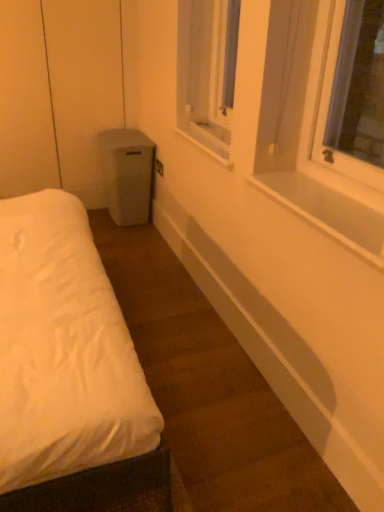
This screenshot has width=384, height=512. Identify the location of white plastic window sill at center, which ranks as the second window sill in front-to-back order. (204, 145).

At what (x,y) coordinates should I click in order to perform the action: click on white smooth window sill at upper right, positioned as the 1th window sill in bottom-to-top order. Please return your answer as a coordinate pair (x, y). The image size is (384, 512). Looking at the image, I should click on (328, 212).

Looking at this image, could you measure the distance between white smooth window sill at upper right, which is counted as the first window sill, starting from the front, and white plastic window sill at center, arranged as the first window sill when viewed from the top?

The distance of white smooth window sill at upper right, which is counted as the first window sill, starting from the front, from white plastic window sill at center, arranged as the first window sill when viewed from the top, is 24.22 inches.

Is the depth of white smooth window sill at upper right, which is counted as the first window sill, starting from the front, less than that of white plastic window sill at center, the 2th window sill when ordered from bottom to top?

Yes, white smooth window sill at upper right, which is counted as the first window sill, starting from the front, is closer to the camera.

Considering the relative sizes of white smooth window sill at upper right, positioned as the 1th window sill in bottom-to-top order, and white plastic window sill at center, the 2th window sill when ordered from bottom to top, in the image provided, is white smooth window sill at upper right, positioned as the 1th window sill in bottom-to-top order, taller than white plastic window sill at center, the 2th window sill when ordered from bottom to top,?

In fact, white smooth window sill at upper right, positioned as the 1th window sill in bottom-to-top order, may be shorter than white plastic window sill at center, the 2th window sill when ordered from bottom to top.

In terms of size, does white smooth window sill at upper right, which is the second window sill from top to bottom, appear bigger or smaller than white plastic window sill at center, which ranks as the second window sill in front-to-back order?

In the image, white smooth window sill at upper right, which is the second window sill from top to bottom, appears to be smaller than white plastic window sill at center, which ranks as the second window sill in front-to-back order.

Is clear plastic window screen at upper center aimed at white smooth window sill at upper right, positioned as the 1th window sill in bottom-to-top order?

No, clear plastic window screen at upper center does not turn towards white smooth window sill at upper right, positioned as the 1th window sill in bottom-to-top order.

Is clear plastic window screen at upper center far from white smooth window sill at upper right, which is the second window sill from top to bottom?

clear plastic window screen at upper center is positioned a significant distance from white smooth window sill at upper right, which is the second window sill from top to bottom.

Could you measure the distance between clear plastic window screen at upper center and white smooth window sill at upper right, which is counted as the first window sill, starting from the front?

clear plastic window screen at upper center is 3.40 feet away from white smooth window sill at upper right, which is counted as the first window sill, starting from the front.

Is clear plastic window screen at upper center closer to camera compared to white smooth window sill at upper right, positioned as the 1th window sill in bottom-to-top order?

That is False.

Is white plastic window sill at center, placed as the 1th window sill when sorted from back to front, oriented away from white smooth window sill at upper right, positioned as the 1th window sill in bottom-to-top order?

No, white plastic window sill at center, placed as the 1th window sill when sorted from back to front, is not facing away from white smooth window sill at upper right, positioned as the 1th window sill in bottom-to-top order.

Can you confirm if white plastic window sill at center, the 2th window sill when ordered from bottom to top, is positioned to the left of white smooth window sill at upper right, which is counted as the first window sill, starting from the front?

Indeed, white plastic window sill at center, the 2th window sill when ordered from bottom to top, is positioned on the left side of white smooth window sill at upper right, which is counted as the first window sill, starting from the front.

Do you think white plastic window sill at center, the 2th window sill when ordered from bottom to top, is within white smooth window sill at upper right, positioned as the 1th window sill in bottom-to-top order, or outside of it?

white plastic window sill at center, the 2th window sill when ordered from bottom to top, lies outside white smooth window sill at upper right, positioned as the 1th window sill in bottom-to-top order.

Could you measure the distance between white plastic window sill at center, which ranks as the second window sill in front-to-back order, and white smooth window sill at upper right, positioned as the 1th window sill in bottom-to-top order?

white plastic window sill at center, which ranks as the second window sill in front-to-back order, and white smooth window sill at upper right, positioned as the 1th window sill in bottom-to-top order, are 24.22 inches apart.

From the image's perspective, which object appears higher, clear plastic window screen at upper center or white plastic window sill at center, the 2th window sill when ordered from bottom to top?

clear plastic window screen at upper center appears higher in the image.

Is clear plastic window screen at upper center aimed at white plastic window sill at center, which ranks as the second window sill in front-to-back order?

Yes, clear plastic window screen at upper center is aimed at white plastic window sill at center, which ranks as the second window sill in front-to-back order.

Between clear plastic window screen at upper center and white plastic window sill at center, the 2th window sill when ordered from bottom to top, which one is positioned in front?

Positioned in front is white plastic window sill at center, the 2th window sill when ordered from bottom to top.

Is white plastic window sill at center, placed as the 1th window sill when sorted from back to front, inside or outside of clear plastic window screen at upper center?

white plastic window sill at center, placed as the 1th window sill when sorted from back to front, is not enclosed by clear plastic window screen at upper center.

Is white plastic window sill at center, the 2th window sill when ordered from bottom to top, to the left of clear plastic window screen at upper center from the viewer's perspective?

Yes.

Based on the photo, from the image's perspective, which object appears higher, white plastic window sill at center, which ranks as the second window sill in front-to-back order, or clear plastic window screen at upper center?

clear plastic window screen at upper center.

Is white plastic window sill at center, placed as the 1th window sill when sorted from back to front, positioned far away from clear plastic window screen at upper center?

No, white plastic window sill at center, placed as the 1th window sill when sorted from back to front, is not far away from clear plastic window screen at upper center.

Considering the sizes of white smooth window sill at upper right, positioned as the second window sill in back-to-front order, and clear plastic window screen at upper center in the image, is white smooth window sill at upper right, positioned as the second window sill in back-to-front order, wider or thinner than clear plastic window screen at upper center?

Considering their sizes, white smooth window sill at upper right, positioned as the second window sill in back-to-front order, looks broader than clear plastic window screen at upper center.

Between white smooth window sill at upper right, positioned as the second window sill in back-to-front order, and clear plastic window screen at upper center, which one is positioned behind?

clear plastic window screen at upper center.

Does white smooth window sill at upper right, which is the second window sill from top to bottom, appear on the right side of clear plastic window screen at upper center?

Yes.

This screenshot has width=384, height=512. In the image, there is a white smooth window sill at upper right, positioned as the second window sill in back-to-front order. Identify the location of window sill above it (from the image's perspective). [204, 145].

Find the location of a particular element. window sill located on the right of clear plastic window screen at upper center is located at coordinates (328, 212).

Looking at this image, when comparing their distances from white plastic window sill at center, arranged as the first window sill when viewed from the top, does white smooth window sill at upper right, positioned as the 1th window sill in bottom-to-top order, or clear plastic window screen at upper center seem further?

white smooth window sill at upper right, positioned as the 1th window sill in bottom-to-top order, is further to white plastic window sill at center, arranged as the first window sill when viewed from the top.

From the image, which object appears to be nearer to white smooth window sill at upper right, positioned as the second window sill in back-to-front order, clear plastic window screen at upper center or white plastic window sill at center, arranged as the first window sill when viewed from the top?

white plastic window sill at center, arranged as the first window sill when viewed from the top.

From the picture: Considering their positions, is clear plastic window screen at upper center positioned closer to white plastic window sill at center, which ranks as the second window sill in front-to-back order, than white smooth window sill at upper right, positioned as the second window sill in back-to-front order?

Among the two, clear plastic window screen at upper center is located nearer to white plastic window sill at center, which ranks as the second window sill in front-to-back order.

Based on their spatial positions, is white plastic window sill at center, the 2th window sill when ordered from bottom to top, or white smooth window sill at upper right, which is counted as the first window sill, starting from the front, closer to clear plastic window screen at upper center?

white plastic window sill at center, the 2th window sill when ordered from bottom to top.

Based on their spatial positions, is white smooth window sill at upper right, which is counted as the first window sill, starting from the front, or white plastic window sill at center, arranged as the first window sill when viewed from the top, closer to clear plastic window screen at upper center?

The object closer to clear plastic window screen at upper center is white plastic window sill at center, arranged as the first window sill when viewed from the top.

Considering their positions, is white plastic window sill at center, arranged as the first window sill when viewed from the top, positioned closer to white smooth window sill at upper right, positioned as the 1th window sill in bottom-to-top order, than clear plastic window screen at upper center?

white plastic window sill at center, arranged as the first window sill when viewed from the top, is closer to white smooth window sill at upper right, positioned as the 1th window sill in bottom-to-top order.

This screenshot has width=384, height=512. Find the location of `window sill between white smooth window sill at upper right, positioned as the second window sill in back-to-front order, and clear plastic window screen at upper center in the front-back direction`. window sill between white smooth window sill at upper right, positioned as the second window sill in back-to-front order, and clear plastic window screen at upper center in the front-back direction is located at coordinates (204, 145).